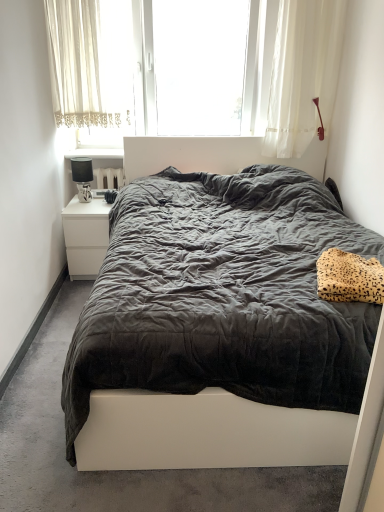
Question: Looking at the image, does leopard print fabric pillow at right seem bigger or smaller compared to matte black lamp at left?

Choices:
 (A) big
 (B) small

Answer: (A)

Question: From a real-world perspective, relative to matte black lamp at left, is leopard print fabric pillow at right vertically above or below?

Choices:
 (A) above
 (B) below

Answer: (B)

Question: Based on their relative distances, which object is nearer to the dark grey fabric bed at center?

Choices:
 (A) white glossy nightstand at upper left
 (B) leopard print fabric pillow at right
 (C) matte black lamp at left
 (D) white sheer curtain at upper left
 (E) white glossy nightstand at left

Answer: (B)

Question: Which is nearer to the white glossy nightstand at upper left?

Choices:
 (A) white sheer curtain at upper left
 (B) white glossy nightstand at left
 (C) leopard print fabric pillow at right
 (D) matte black lamp at left
 (E) white sheer curtain at upper center

Answer: (D)